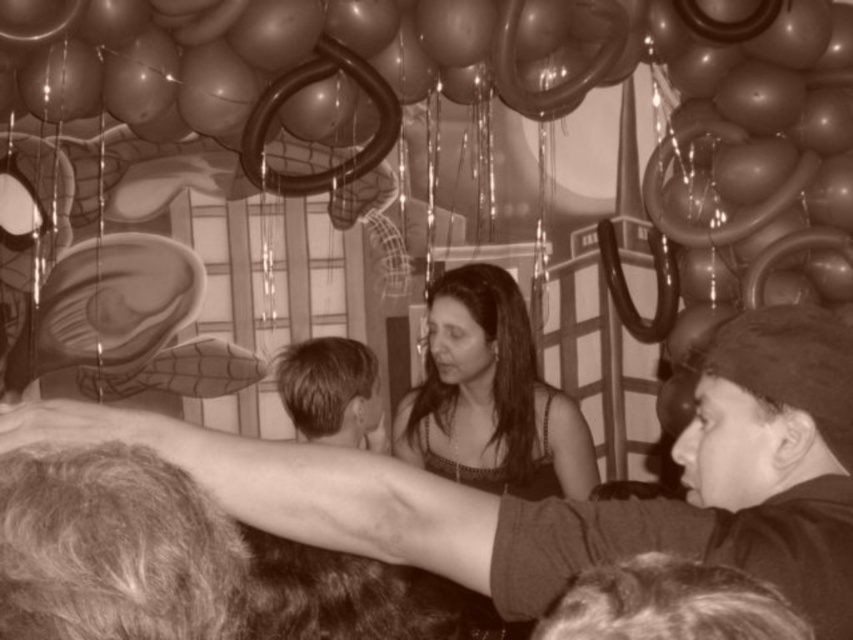
Question: Is matte black dress at center to the right of dark brown hair at center from the viewer's perspective?

Choices:
 (A) no
 (B) yes

Answer: (B)

Question: Does matte black dress at center have a smaller size compared to dark brown hair at center?

Choices:
 (A) yes
 (B) no

Answer: (A)

Question: Among these points, which one is farthest from the camera?

Choices:
 (A) (300, 385)
 (B) (395, 420)

Answer: (B)

Question: Which object is closer to the camera taking this photo?

Choices:
 (A) matte black dress at center
 (B) dark brown hair at center

Answer: (B)

Question: Can you confirm if matte black dress at center is wider than dark brown hair at center?

Choices:
 (A) no
 (B) yes

Answer: (B)

Question: Which point is farther to the camera?

Choices:
 (A) 498,444
 (B) 329,384

Answer: (A)